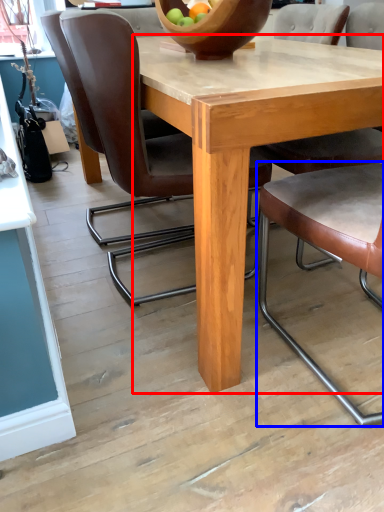
Question: Which object is further to the camera taking this photo, round table (highlighted by a red box) or chair (highlighted by a blue box)?

Choices:
 (A) round table
 (B) chair

Answer: (A)